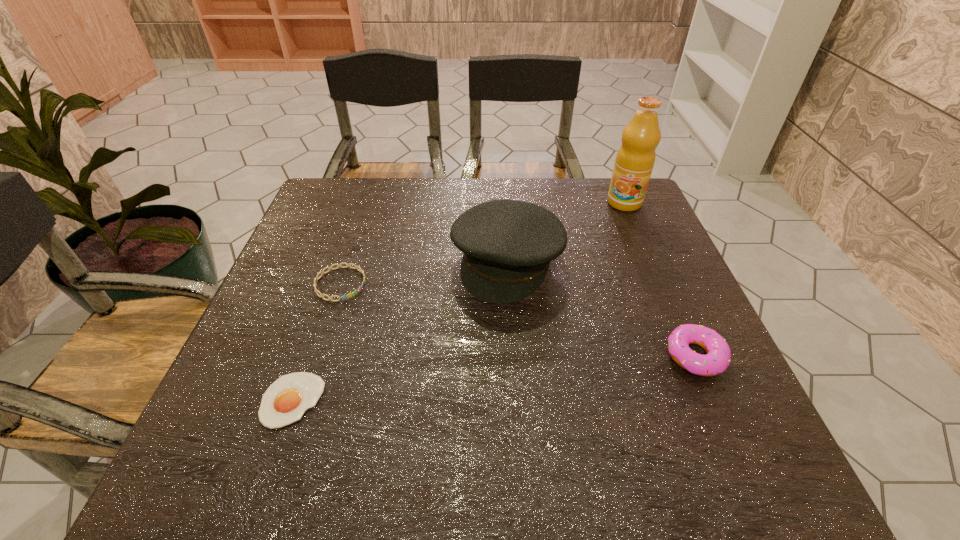
The height and width of the screenshot is (540, 960). What are the coordinates of `free space on the desktop that is between the egg yolk and the third shortest object and is positioned on the surface of the fourth tallest object showing star-shaped elements` in the screenshot? It's located at (490, 379).

Find the location of a particular element. free space on the desktop that is between the egg yolk and the doughnut and is positioned on the front-facing side of the beret is located at coordinates (450, 383).

Find the location of `free space on the desktop that is between the shortest object and the third shortest object and is positioned on the front label of the fruit juice`. free space on the desktop that is between the shortest object and the third shortest object and is positioned on the front label of the fruit juice is located at coordinates (538, 373).